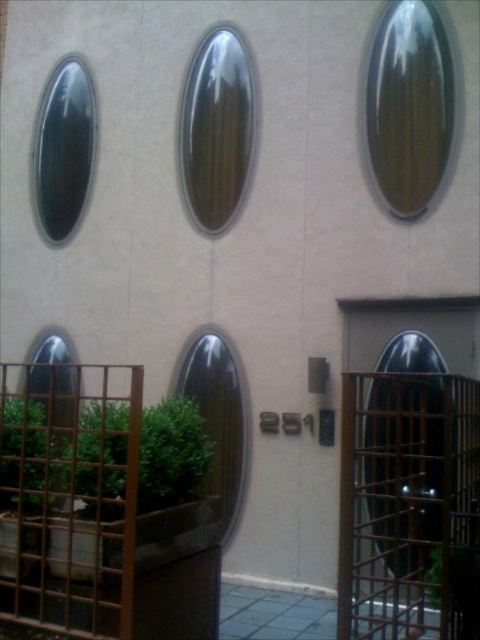
You are a delivery person trying to enter the building through the black glass door at center. There is a glossy glass oval at center near it. Can you fit a 1.5 meter wide delivery cart through the door?

The black glass door at center is wider than the glossy glass oval at center. Since the door is wider, the 1.5 meter wide delivery cart should fit through the black glass door at center.

You are a delivery person approaching the building and need to find the entrance. The black glass door at center and the glossy glass oval at center are both in your line of sight. Which object should you look below to find the entrance?

The entrance is located below the glossy glass oval at center, so you should look below the glossy glass oval at center to find the entrance since the black glass door at center is positioned there.